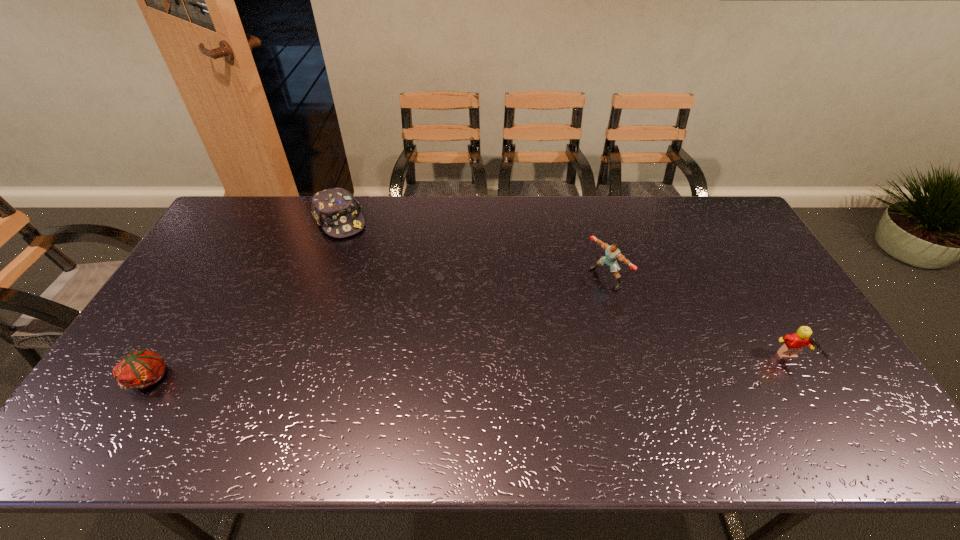
The width and height of the screenshot is (960, 540). What are the coordinates of `the leftmost object` in the screenshot? It's located at (140, 369).

At what (x,y) coordinates should I click in order to perform the action: click on tomato. Please return your answer as a coordinate pair (x, y). Looking at the image, I should click on (140, 369).

Find the location of a particular element. the rightmost object is located at coordinates (793, 344).

Where is `the tallest object`? This screenshot has height=540, width=960. the tallest object is located at coordinates (612, 253).

The height and width of the screenshot is (540, 960). I want to click on the third nearest object, so click(612, 253).

You are a GUI agent. You are given a task and a screenshot of the screen. Output one action in this format:
    pyautogui.click(x=<x>, y=<y>)
    Task: Click on the headwear
    The image size is (960, 540).
    Given the screenshot: What is the action you would take?
    pyautogui.click(x=336, y=210)

Where is `the farthest object`? the farthest object is located at coordinates (336, 210).

Identify the location of free space located on the front-facing side of the second object from right to left. The image size is (960, 540). (582, 295).

The height and width of the screenshot is (540, 960). Find the location of `vacant region located on the front-facing side of the second object from right to left`. vacant region located on the front-facing side of the second object from right to left is located at coordinates (572, 300).

This screenshot has height=540, width=960. I want to click on free space located 0.400m on the front-facing side of the second object from right to left, so click(x=489, y=350).